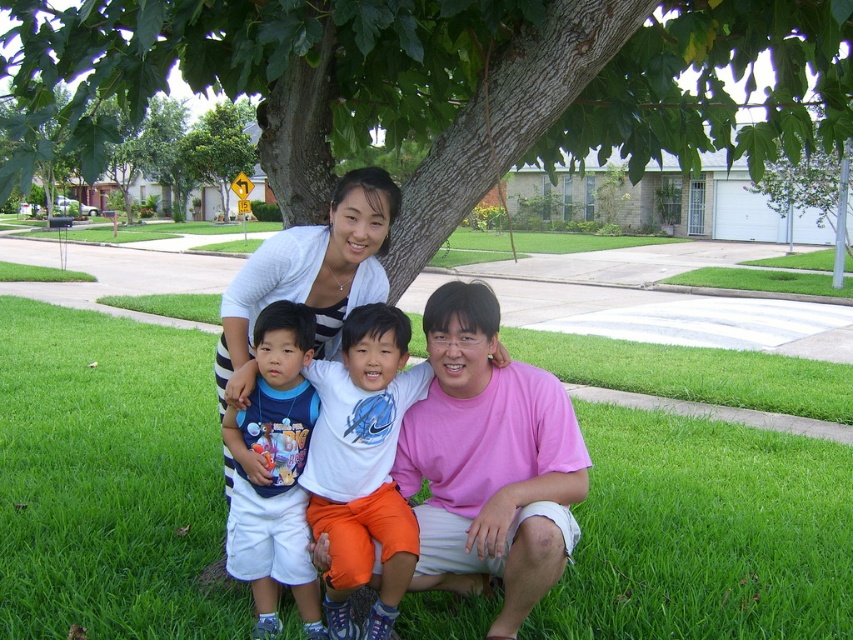
Which is behind, point (779, 109) or point (373, 248)?

The point (779, 109) is behind.

Does green leafy tree at center have a greater height compared to white striped shirt at upper center?

No, green leafy tree at center is not taller than white striped shirt at upper center.

Measure the distance between green leafy tree at center and camera.

green leafy tree at center and camera are 3.94 meters apart from each other.

Where is `green leafy tree at center`? The width and height of the screenshot is (853, 640). green leafy tree at center is located at coordinates (440, 84).

Can you confirm if white cotton shirt at center is positioned below green leafy tree at upper left?

Indeed, white cotton shirt at center is positioned under green leafy tree at upper left.

Is point (389, 429) less distant than point (212, 134)?

Yes, it is in front of point (212, 134).

Locate an element on the screen. The image size is (853, 640). white cotton shirt at center is located at coordinates (363, 465).

Is point (560, 563) closer to viewer compared to point (264, 480)?

Yes, it is in front of point (264, 480).

Looking at this image, can you confirm if pink cotton shirt at center is wider than blue cotton shirt at center?

Yes, pink cotton shirt at center is wider than blue cotton shirt at center.

Is point (445, 538) positioned in front of point (306, 592)?

Yes, it is in front of point (306, 592).

Locate an element on the screen. pink cotton shirt at center is located at coordinates coord(488,461).